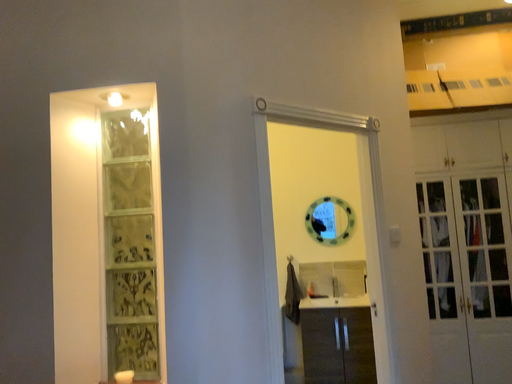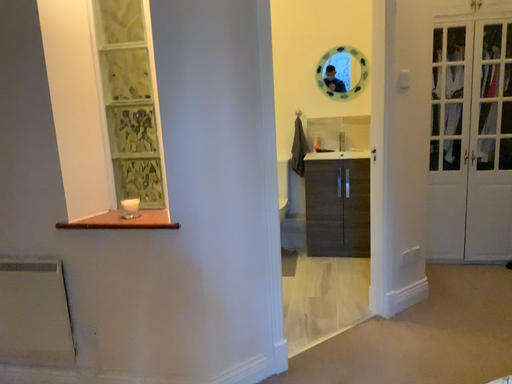
Question: Which way did the camera rotate in the video?

Choices:
 (A) rotated downward
 (B) rotated upward

Answer: (A)